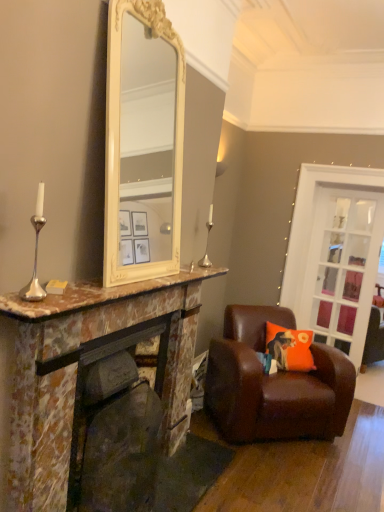
Question: Considering the positions of point (211, 218) and point (104, 391), is point (211, 218) closer or farther from the camera than point (104, 391)?

Choices:
 (A) farther
 (B) closer

Answer: (A)

Question: In the image, is silver/metallic candle holder at center positioned in front of or behind marble fireplace at center?

Choices:
 (A) front
 (B) behind

Answer: (B)

Question: Estimate the real-world distances between objects in this image. Which object is closer to the marble fireplace at left?

Choices:
 (A) silver/metallic candle holder at center
 (B) brown leather chair at lower right
 (C) orange fabric cushion at right
 (D) clear glass door at right
 (E) marble fireplace at center

Answer: (E)

Question: Estimate the real-world distances between objects in this image. Which object is farther from the orange fabric cushion at right?

Choices:
 (A) marble fireplace at left
 (B) marble fireplace at center
 (C) silver/metallic candle holder at center
 (D) clear glass door at right
 (E) brown leather chair at lower right

Answer: (B)